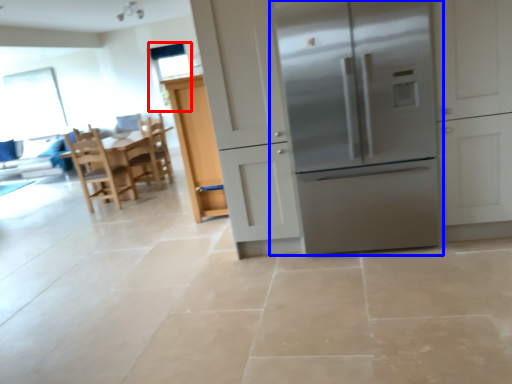
Question: Which of the following is the closest to the observer, window screen (highlighted by a red box) or refrigerator (highlighted by a blue box)?

Choices:
 (A) window screen
 (B) refrigerator

Answer: (B)